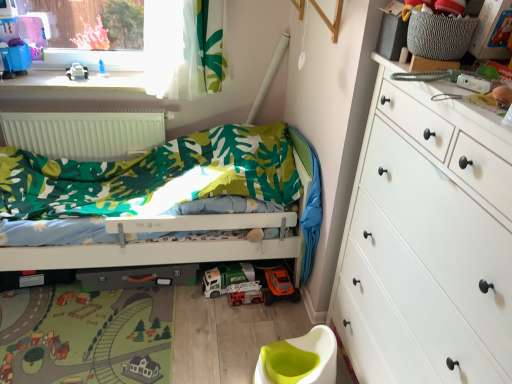
You are a GUI agent. You are given a task and a screenshot of the screen. Output one action in this format:
    pyautogui.click(x=<x>, y=<y>)
    Task: Click on the empty space that is ontop of white plastic toy car at lower center, marked as the 2th toy car in a bottom-to-top arrangement (from a real-world perspective)
    Image resolution: width=512 pixels, height=384 pixels.
    Given the screenshot: What is the action you would take?
    pyautogui.click(x=228, y=271)